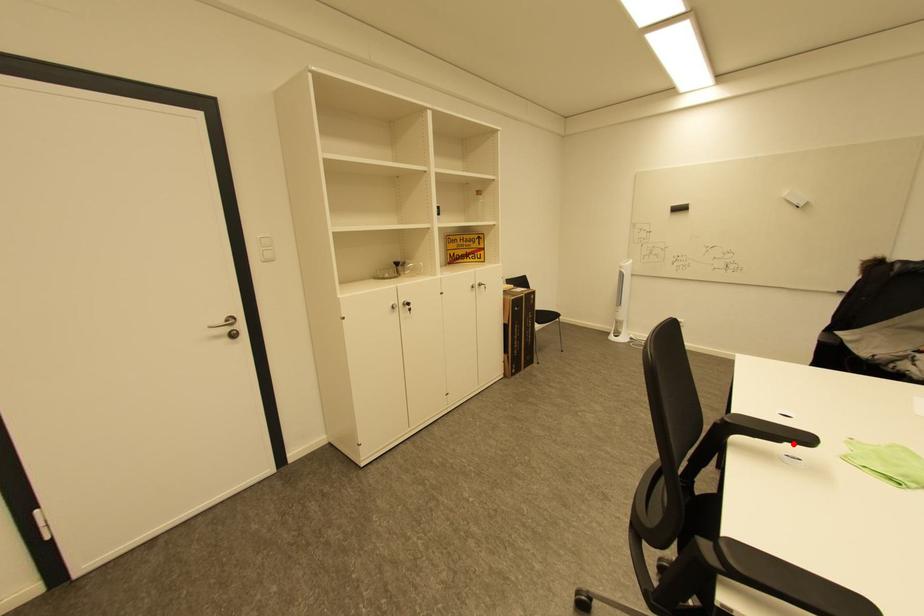
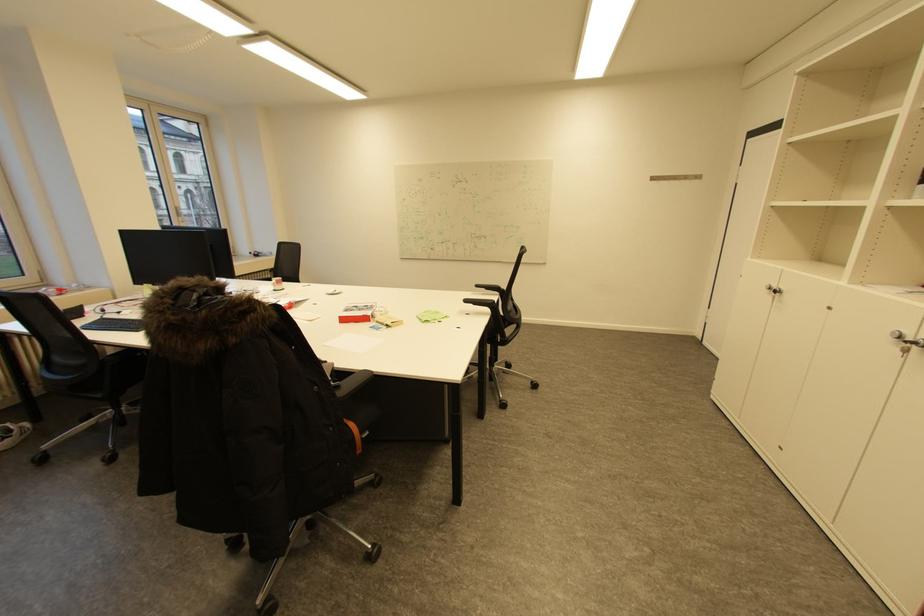
Where in the second image is the point corresponding to the highlighted location from the first image?

(480, 304)